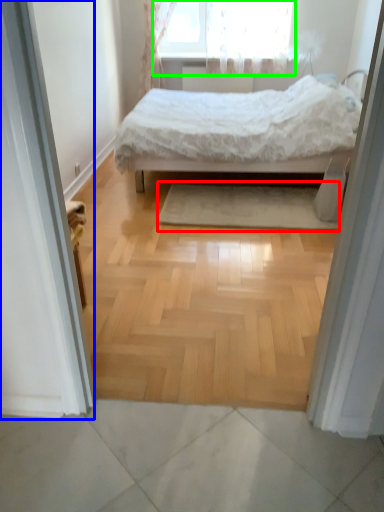
Question: Which object is positioned farthest from mat (highlighted by a red box)? Select from screen door (highlighted by a blue box) and window (highlighted by a green box).

Choices:
 (A) screen door
 (B) window

Answer: (B)